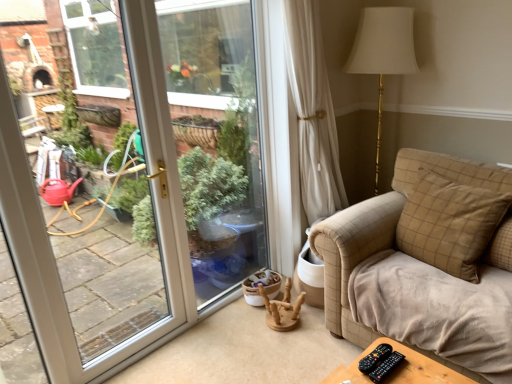
Question: Should I look upward or downward to see black plastic remote at lower right, which ranks as the first remote in right-to-left order?

Choices:
 (A) up
 (B) down

Answer: (B)

Question: From a real-world perspective, does beige checkered pillow at right, which is counted as the first pillow, starting from the back, sit lower than black plastic remote at lower right, which is counted as the second remote, starting from the right?

Choices:
 (A) yes
 (B) no

Answer: (B)

Question: Can you confirm if beige checkered pillow at right, placed as the 2th pillow when sorted from front to back, is smaller than black plastic remote at lower right, which is counted as the second remote, starting from the right?

Choices:
 (A) no
 (B) yes

Answer: (A)

Question: From the image's perspective, does beige checkered pillow at right, placed as the 2th pillow when sorted from front to back, appear lower than black plastic remote at lower right, which is counted as the second remote, starting from the right?

Choices:
 (A) no
 (B) yes

Answer: (A)

Question: Would you say beige checkered pillow at right, placed as the 2th pillow when sorted from front to back, is a long distance from black plastic remote at lower right, which ranks as the first remote in left-to-right order?

Choices:
 (A) yes
 (B) no

Answer: (B)

Question: Can you confirm if beige checkered pillow at right, which is counted as the first pillow, starting from the back, is positioned to the left of black plastic remote at lower right, which ranks as the first remote in left-to-right order?

Choices:
 (A) yes
 (B) no

Answer: (B)

Question: Is beige checkered pillow at right, placed as the 2th pillow when sorted from front to back, oriented towards black plastic remote at lower right, which ranks as the first remote in left-to-right order?

Choices:
 (A) no
 (B) yes

Answer: (B)

Question: From a real-world perspective, is wooden at center over beige checkered pillow at right, placed as the second pillow when sorted from back to front?

Choices:
 (A) yes
 (B) no

Answer: (B)

Question: Does wooden at center have a larger size compared to beige checkered pillow at right, placed as the second pillow when sorted from back to front?

Choices:
 (A) yes
 (B) no

Answer: (B)

Question: Is wooden at center not inside beige checkered pillow at right, placed as the second pillow when sorted from back to front?

Choices:
 (A) yes
 (B) no

Answer: (A)

Question: Is wooden at center not close to beige checkered pillow at right, placed as the second pillow when sorted from back to front?

Choices:
 (A) yes
 (B) no

Answer: (B)

Question: Can you confirm if wooden at center is shorter than beige checkered pillow at right, placed as the second pillow when sorted from back to front?

Choices:
 (A) no
 (B) yes

Answer: (B)

Question: Is wooden at center facing away from beige checkered pillow at right, the 1th pillow viewed from the front?

Choices:
 (A) yes
 (B) no

Answer: (B)

Question: Is black plastic remote at lower right, which ranks as the first remote in left-to-right order, next to beige checkered pillow at right, the 1th pillow viewed from the front?

Choices:
 (A) yes
 (B) no

Answer: (B)